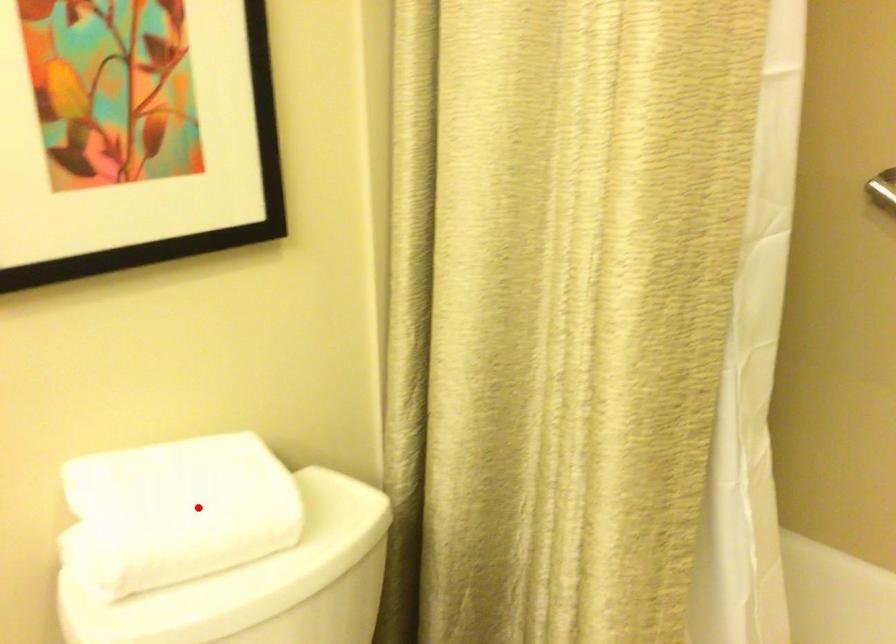
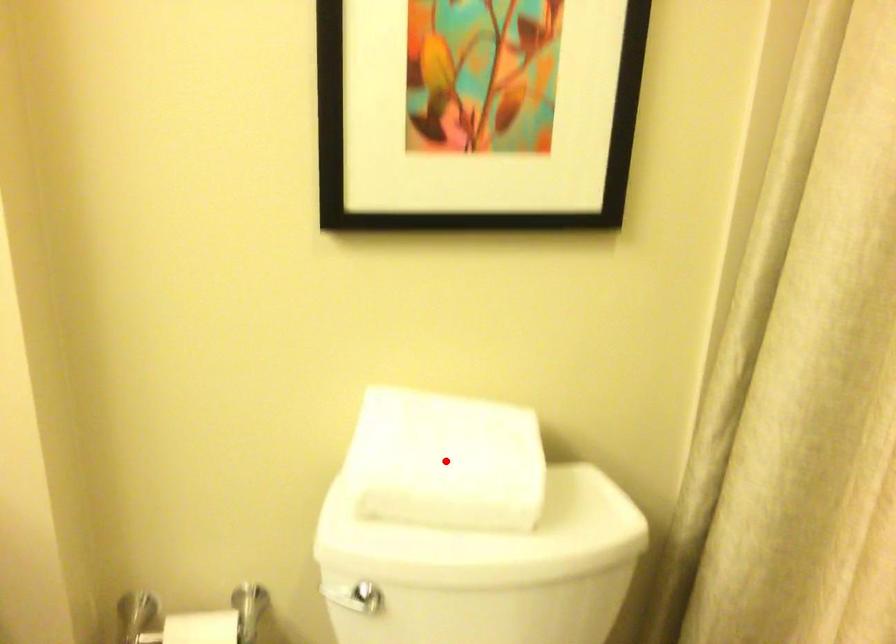
I am providing you with two images of the same scene from different viewpoints. A red point is marked on the first image and another point is marked on the second image. Do the highlighted points in image1 and image2 indicate the same real-world spot?

Yes